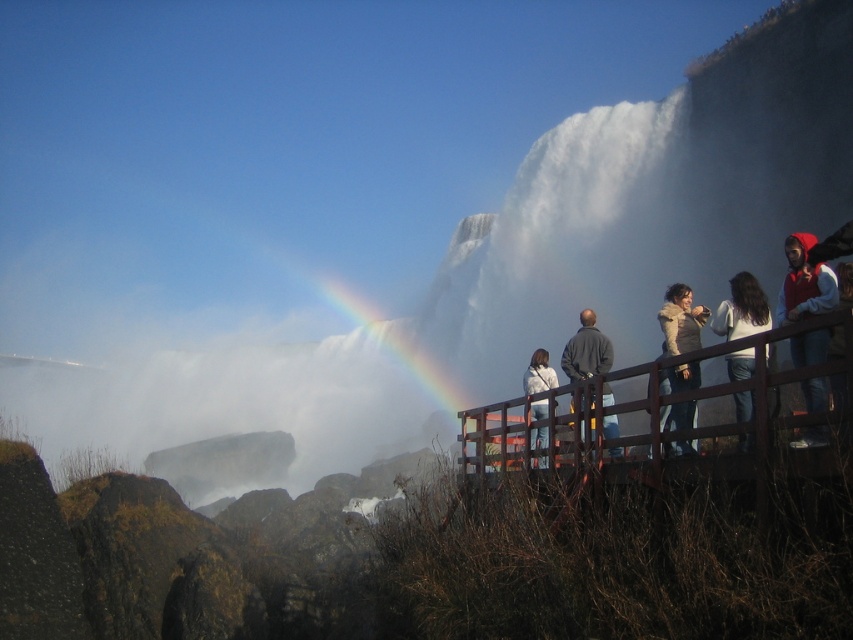
You are a photographer at Niagara Falls and want to capture a photo of the two tourists wearing the white matte jacket at upper right and the light brown fur coat at center. Which tourist is wearing a smaller jacket?

The white matte jacket at upper right has a smaller size compared to the light brown fur coat at center, so the tourist wearing the white matte jacket at upper right has the smaller jacket.

You are standing at the viewing platform at Niagara Falls and notice two points marked in the image. Which point, point [753,285] or point [699,339], is closer to you?

Point [753,285] is closer to the camera than point [699,339].

Based on the photo, you are a photographer standing at the viewing platform at Niagara Falls. You want to capture a photo of the dark gray jacket at center while ensuring the rainbow in the background is also in focus. Given that your camera has a depth of field that can cover 25 meters, will both the jacket and the rainbow be in focus?

The dark gray jacket at center is 24.40 meters away from the camera. Since the depth of field can cover 25 meters, both the jacket and the rainbow in the background will be within the focus range and thus in focus.